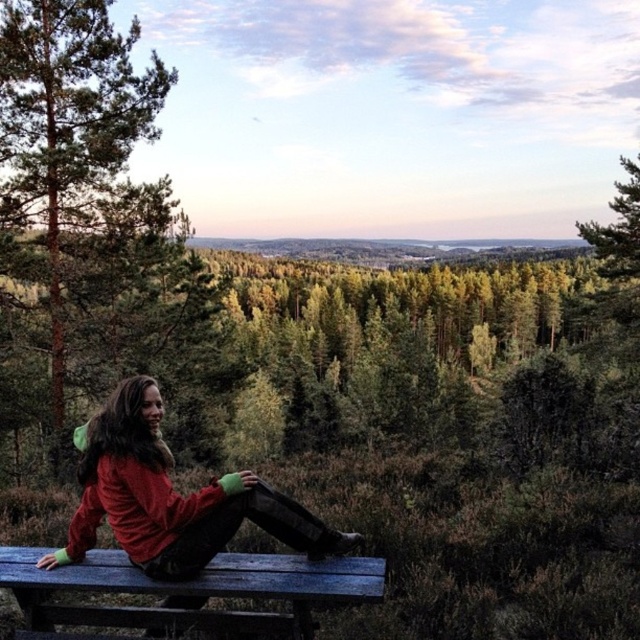
Consider the image. Who is positioned more to the right, brown wood tree at left or red fleece jacket at lower left?

red fleece jacket at lower left is more to the right.

The height and width of the screenshot is (640, 640). What do you see at coordinates (72, 193) in the screenshot?
I see `brown wood tree at left` at bounding box center [72, 193].

Which is in front, point (108, 346) or point (195, 515)?

Point (195, 515) is more forward.

You are a GUI agent. You are given a task and a screenshot of the screen. Output one action in this format:
    pyautogui.click(x=<x>, y=<y>)
    Task: Click on the brown wood tree at left
    Image resolution: width=640 pixels, height=640 pixels.
    Given the screenshot: What is the action you would take?
    pyautogui.click(x=72, y=193)

Is red fleece jacket at lower left below green leafy tree at upper right?

Yes, red fleece jacket at lower left is below green leafy tree at upper right.

Does red fleece jacket at lower left have a greater height compared to green leafy tree at upper right?

No, red fleece jacket at lower left is not taller than green leafy tree at upper right.

Locate an element on the screen. red fleece jacket at lower left is located at coordinates (172, 499).

Does brown wood tree at left appear under green leafy tree at upper right?

Indeed, brown wood tree at left is positioned under green leafy tree at upper right.

Who is positioned more to the right, brown wood tree at left or green leafy tree at upper right?

green leafy tree at upper right

Measure the distance between point (x=33, y=198) and camera.

Point (x=33, y=198) is 17.81 meters away from camera.

The width and height of the screenshot is (640, 640). I want to click on brown wood tree at left, so click(72, 193).